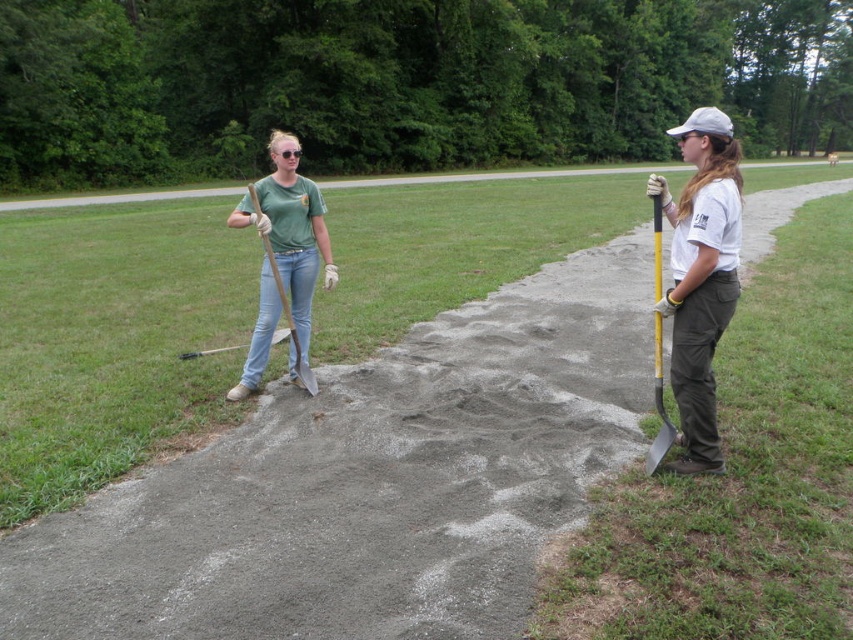
You are a photographer trying to capture a group photo of the two people in the scene. If you want to ensure that both the matte white shirt at center and the matte green shirt at center are fully visible in the frame, which person should you position closer to the camera?

The matte white shirt at center is taller than the matte green shirt at center, so to ensure both are fully visible, position the matte green shirt at center closer to the camera.

You are a landscape worker who needs to determine the best tool to use for trimming the green grass at right. Considering the height of the grass and the yellow plastic shovel at right, which tool would be more appropriate for this task?

The green grass at right has a lesser height compared to yellow plastic shovel at right, so the yellow plastic shovel at right is taller than the grass. However, a shovel is not suitable for trimming grass. A lawn mower or trimmer would be more appropriate for this task.